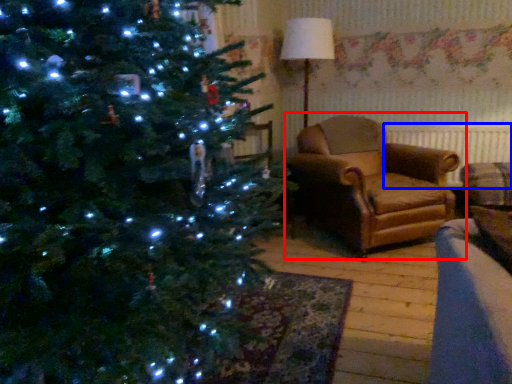
Question: Which of the following is the closest to the observer, studio couch (highlighted by a red box) or radiator (highlighted by a blue box)?

Choices:
 (A) studio couch
 (B) radiator

Answer: (A)